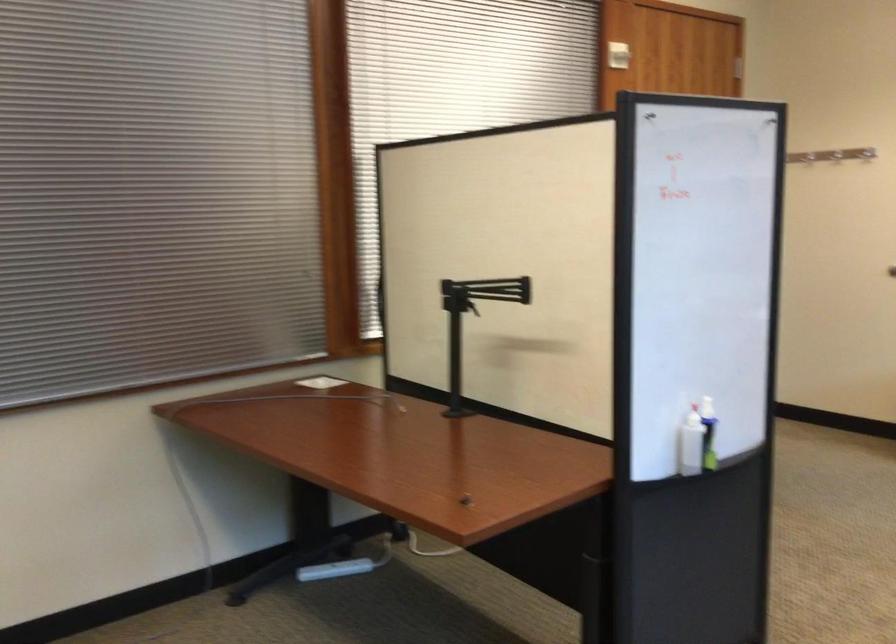
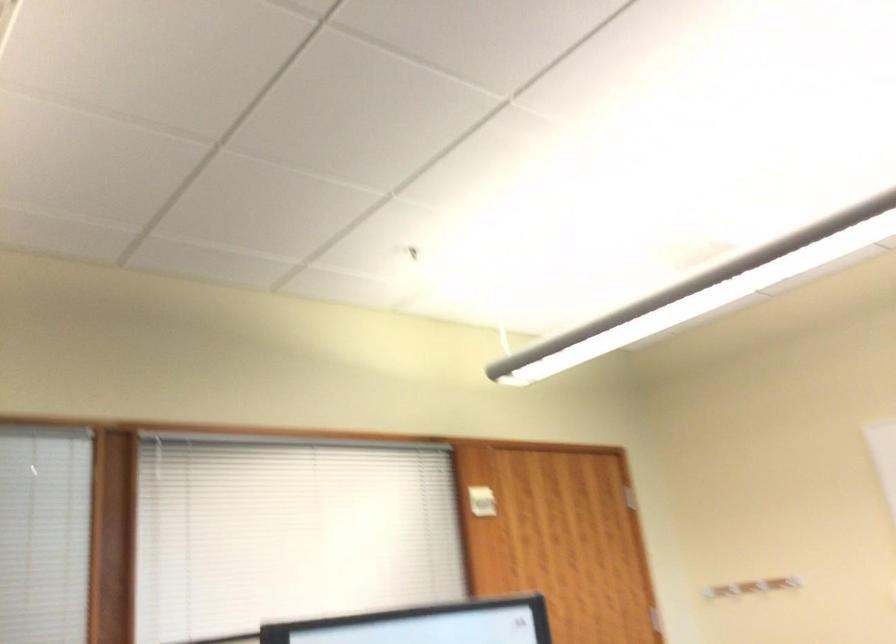
Which direction would the cameraman need to move to produce the second image?

The cameraman moved toward right, forward.